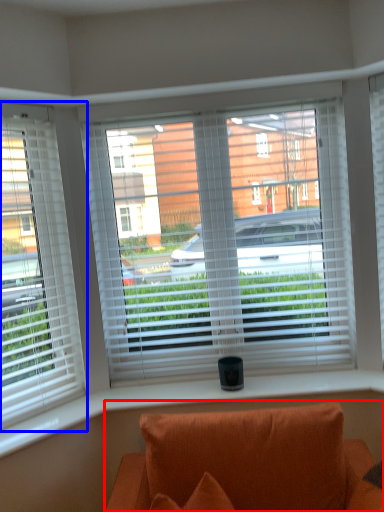
Question: Among these objects, which one is farthest to the camera, studio couch (highlighted by a red box) or window (highlighted by a blue box)?

Choices:
 (A) studio couch
 (B) window

Answer: (B)